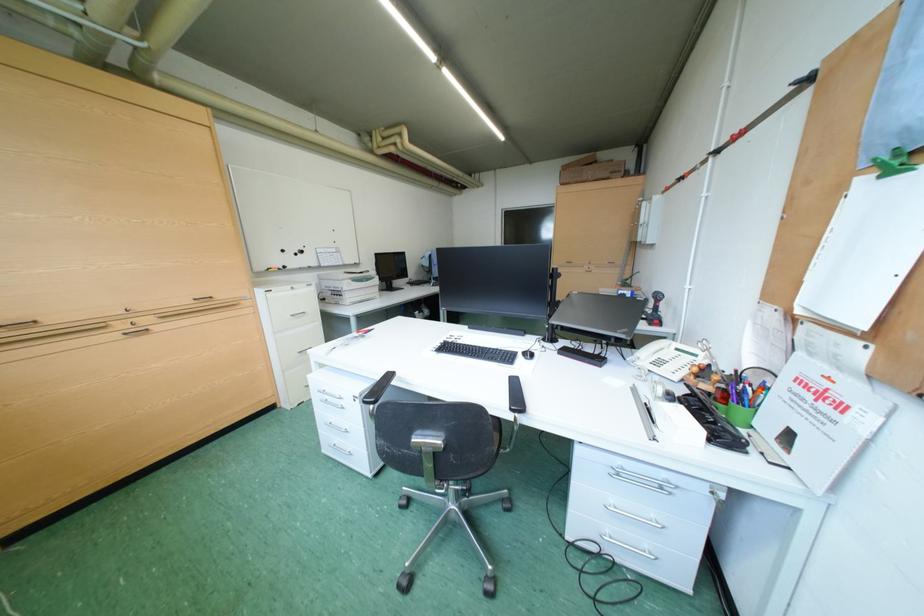
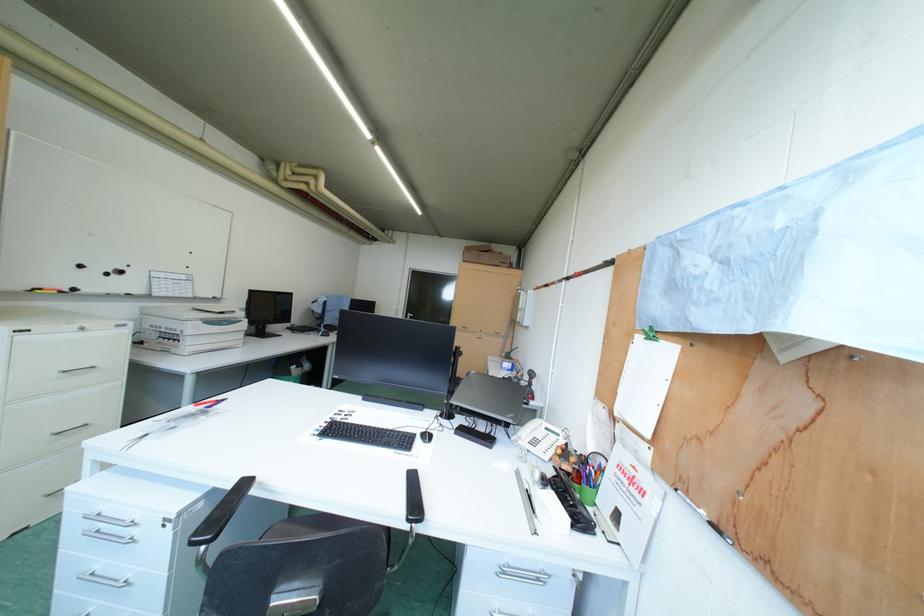
Question: In a continuous first-person perspective shot, in which direction is the camera moving?

Choices:
 (A) Left
 (B) Right
 (C) Forward
 (D) Backward

Answer: (A)